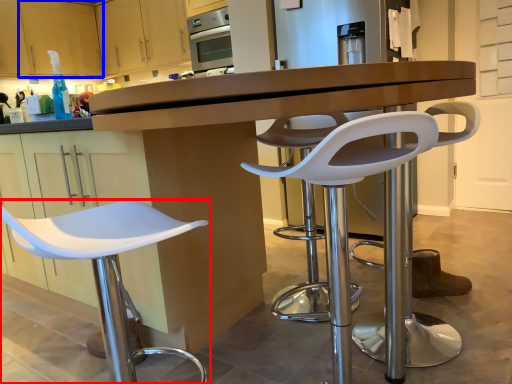
Question: Among these objects, which one is nearest to the camera, chair (highlighted by a red box) or cabinetry (highlighted by a blue box)?

Choices:
 (A) chair
 (B) cabinetry

Answer: (A)